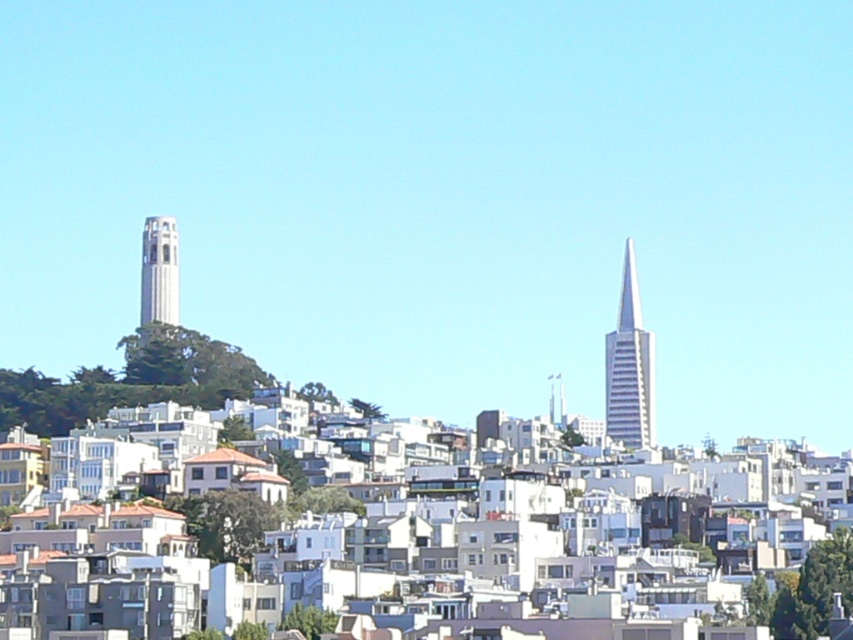
You are a drone operator tasked with flying a drone between the silver glass skyscraper at right and the white stone tower at left. The drone has a maximum flight distance of 100 meters. Can the drone safely fly between them without exceeding its range?

The silver glass skyscraper at right and white stone tower at left are 110.55 meters apart. Since the drone can only fly up to 100 meters, it cannot safely fly between them without exceeding its range.

You are standing at the base of the hill in the cityscape. You notice two points marked in the image. The first point is at coordinate (648,376), and the second is at (144,305). Which point is closer to your current position?

Point (144,305) is closer to your current position because it is in front of point (648,376).